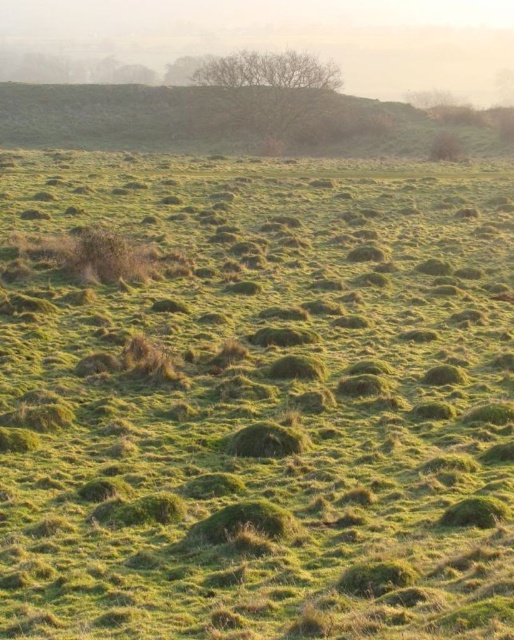
Does point (359, 29) come closer to viewer compared to point (175, 93)?

That is False.

From the picture: Does foggy mist at upper center have a lesser width compared to green grassy hillside at upper center?

Incorrect, foggy mist at upper center's width is not less than green grassy hillside at upper center's.

Who is more forward, (325, 17) or (302, 115)?

Positioned in front is point (302, 115).

Locate an element on the screen. This screenshot has height=640, width=514. foggy mist at upper center is located at coordinates (289, 36).